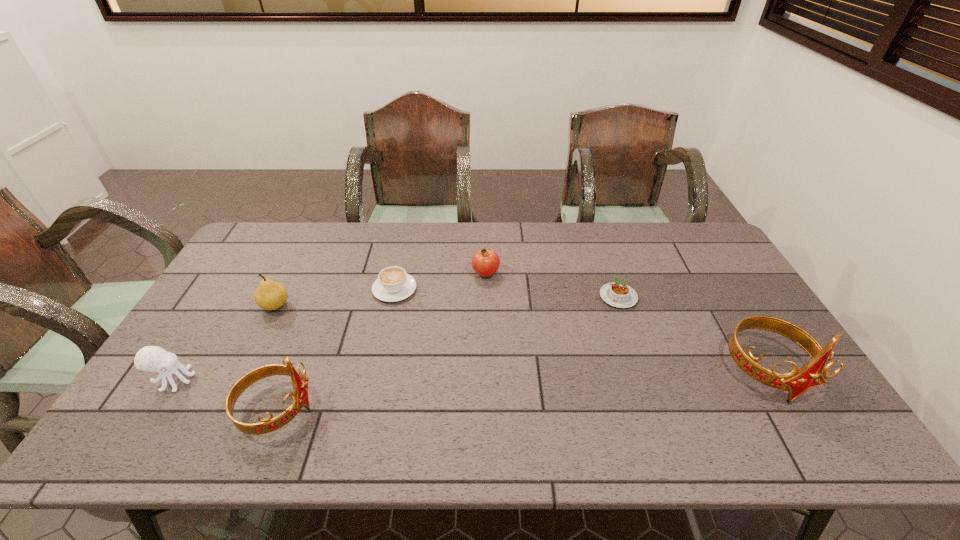
What are the coordinates of `free space between the octopus and the fifth object from left to right` in the screenshot? It's located at (329, 327).

Locate which object is the sixth closest to the third object from right to left. Please provide its 2D coordinates. Your answer should be formatted as a tuple, i.e. [(x, y)], where the tuple contains the x and y coordinates of a point satisfying the conditions above.

[(149, 358)]

This screenshot has height=540, width=960. Identify the location of object that stands as the sixth closest to the pear. (815, 372).